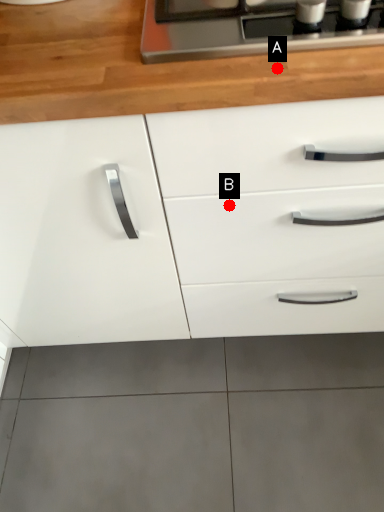
Question: Two points are circled on the image, labeled by A and B beside each circle. Which point is closer to the camera taking this photo?

Choices:
 (A) A is closer
 (B) B is closer

Answer: (A)